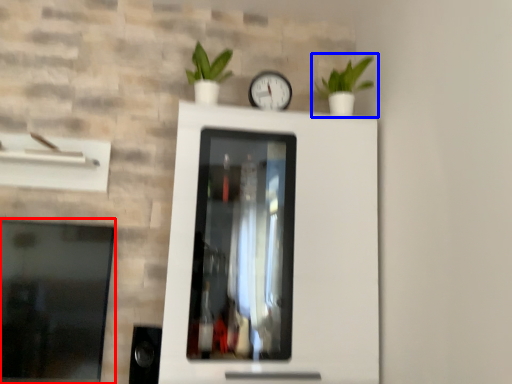
Question: Among these objects, which one is nearest to the camera, window (highlighted by a red box) or houseplant (highlighted by a blue box)?

Choices:
 (A) window
 (B) houseplant

Answer: (A)